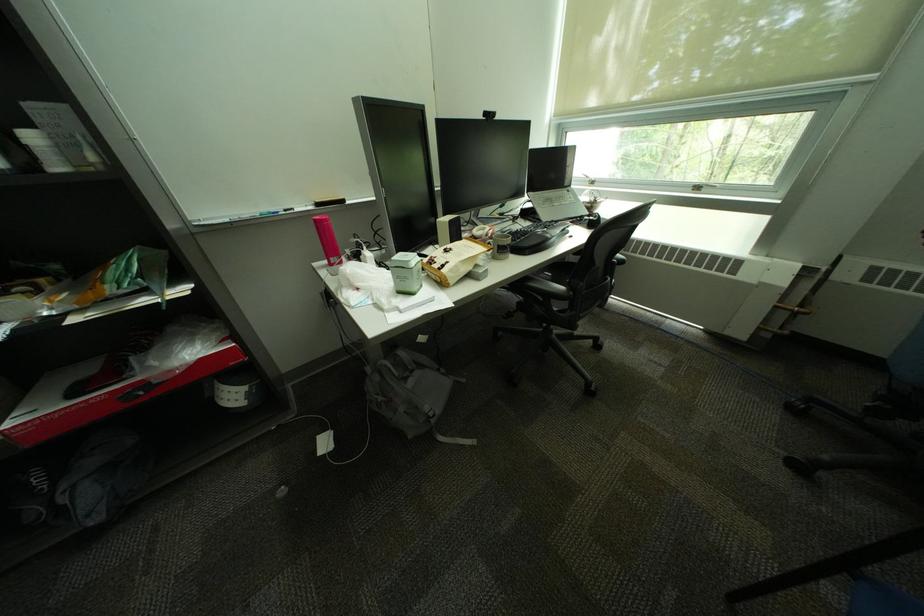
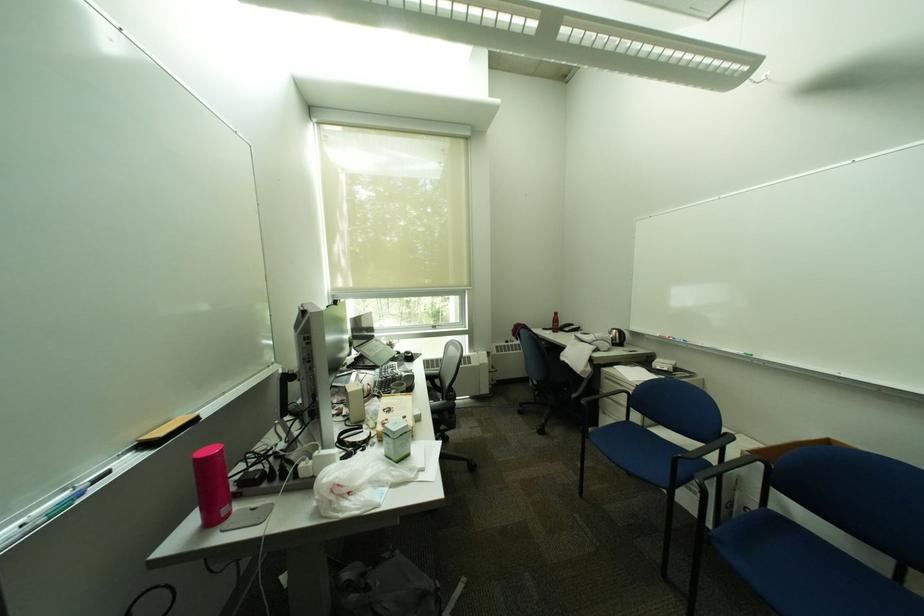
Where in the second image is the point corresponding to [445,259] from the first image?

(397, 421)